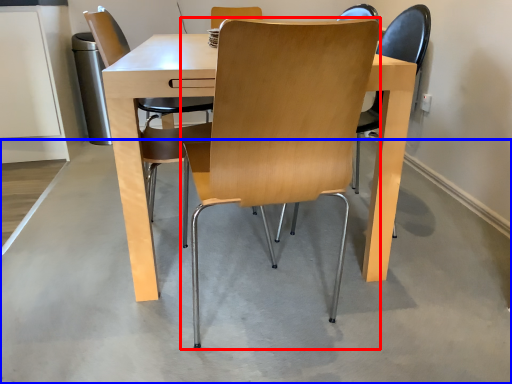
Question: Which object appears farthest to the camera in this image, chair (highlighted by a red box) or concrete (highlighted by a blue box)?

Choices:
 (A) chair
 (B) concrete

Answer: (B)